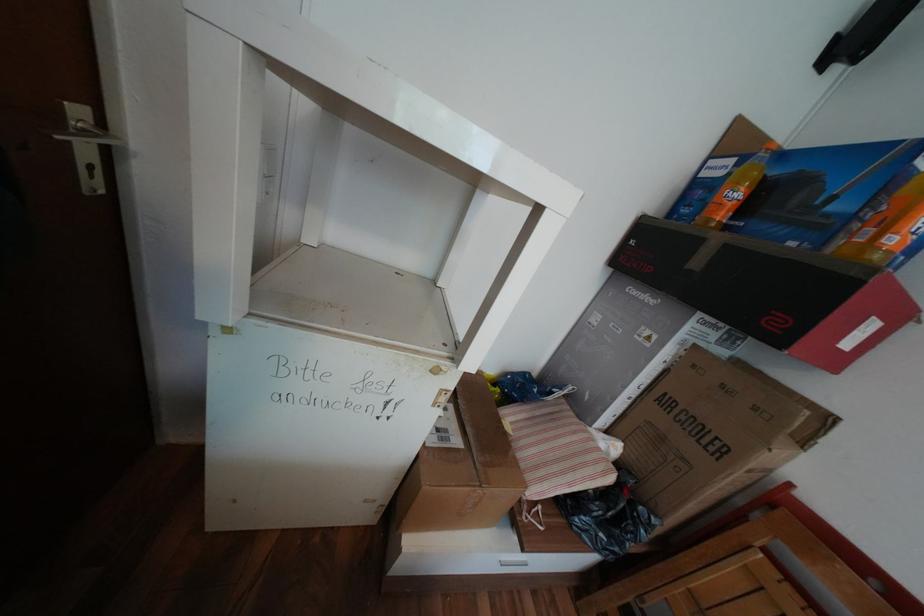
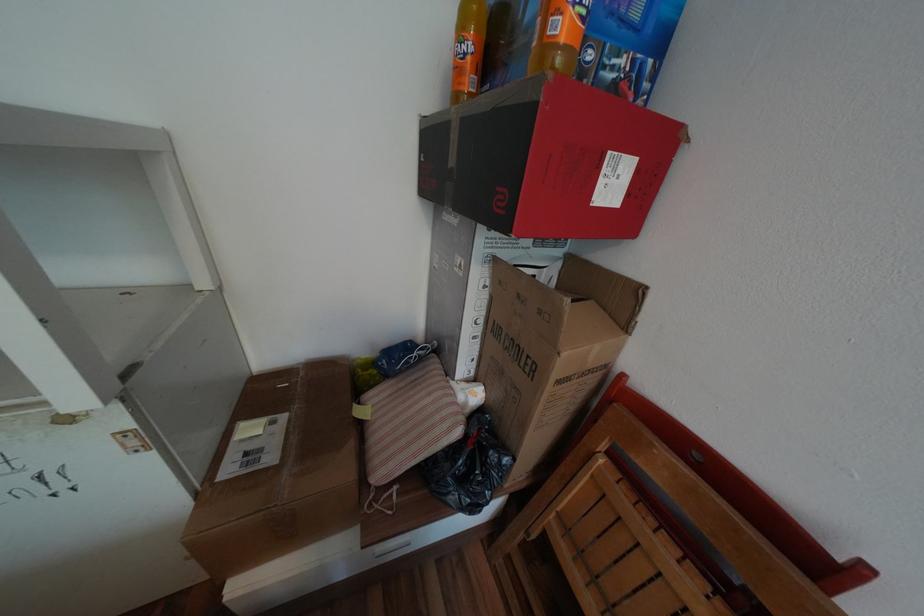
Find the pixel in the second image that matches [864,333] in the first image.

(611, 182)